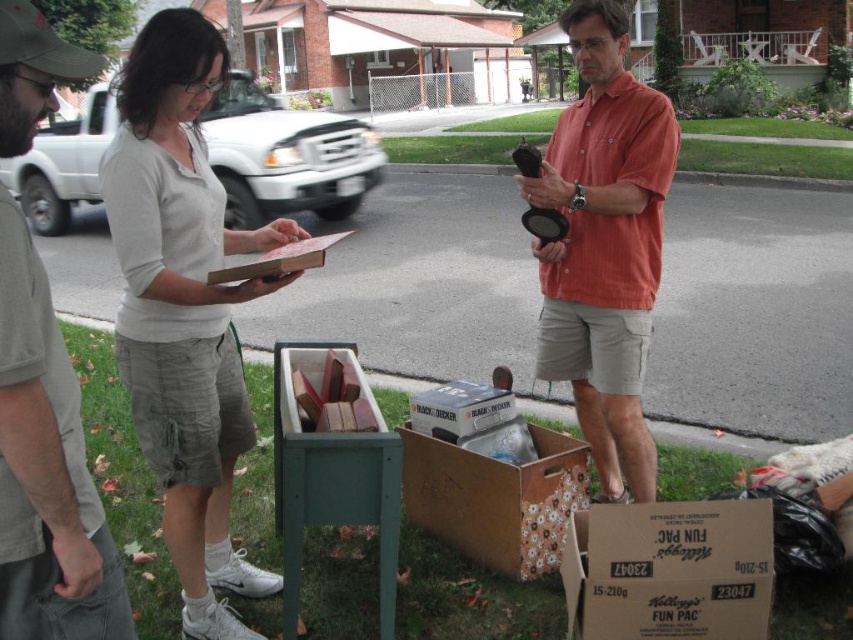
Between matte orange shirt at center and cardboard box at lower right, which one has more height?

matte orange shirt at center

Image resolution: width=853 pixels, height=640 pixels. Describe the element at coordinates (604, 244) in the screenshot. I see `matte orange shirt at center` at that location.

Locate an element on the screen. Image resolution: width=853 pixels, height=640 pixels. matte orange shirt at center is located at coordinates (604, 244).

Is matte orange shirt at center positioned before gray cotton t-shirt at left?

No, it is behind gray cotton t-shirt at left.

The width and height of the screenshot is (853, 640). Describe the element at coordinates (604, 244) in the screenshot. I see `matte orange shirt at center` at that location.

You are a GUI agent. You are given a task and a screenshot of the screen. Output one action in this format:
    pyautogui.click(x=<x>, y=<y>)
    Task: Click on the matte orange shirt at center
    
    Given the screenshot: What is the action you would take?
    pos(604,244)

Is white matte shirt at upper left thinner than matte orange shirt at center?

In fact, white matte shirt at upper left might be wider than matte orange shirt at center.

Is point (149, 148) less distant than point (657, 115)?

That is True.

This screenshot has width=853, height=640. Find the location of `white matte shirt at upper left`. white matte shirt at upper left is located at coordinates (184, 307).